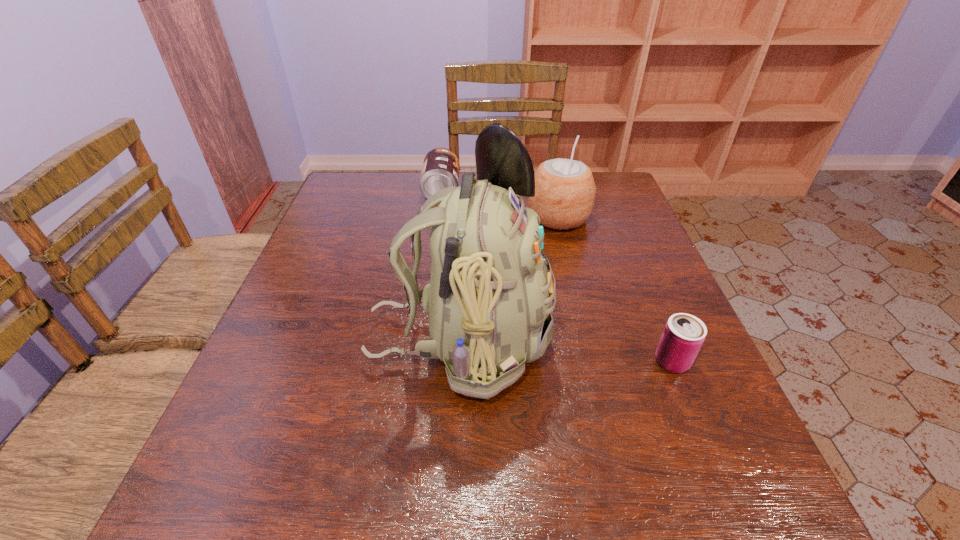
Identify the location of can that is at the far edge. (441, 166).

You are a GUI agent. You are given a task and a screenshot of the screen. Output one action in this format:
    pyautogui.click(x=<x>, y=<y>)
    Task: Click on the coconut situated at the right edge
    This screenshot has height=540, width=960.
    Given the screenshot: What is the action you would take?
    pyautogui.click(x=565, y=190)

This screenshot has height=540, width=960. Find the location of `can at the right edge`. can at the right edge is located at coordinates (684, 334).

Locate an element on the screen. Image resolution: width=960 pixels, height=540 pixels. object located at the far right corner is located at coordinates (565, 190).

This screenshot has width=960, height=540. In order to click on free space at the near edge of the desktop in this screenshot , I will do `click(341, 514)`.

In the image, there is a desktop. At what (x,y) coordinates should I click in order to perform the action: click on vacant space at the left edge. Please return your answer as a coordinate pair (x, y). Looking at the image, I should click on (259, 379).

Where is `vacant area at the far left corner`? vacant area at the far left corner is located at coordinates (356, 181).

This screenshot has height=540, width=960. Find the location of `vacant space at the near left corner`. vacant space at the near left corner is located at coordinates (220, 477).

This screenshot has width=960, height=540. In order to click on free space at the far right corner in this screenshot , I will do `click(617, 212)`.

In the image, there is a desktop. Where is `vacant space at the near right corner`? vacant space at the near right corner is located at coordinates (658, 482).